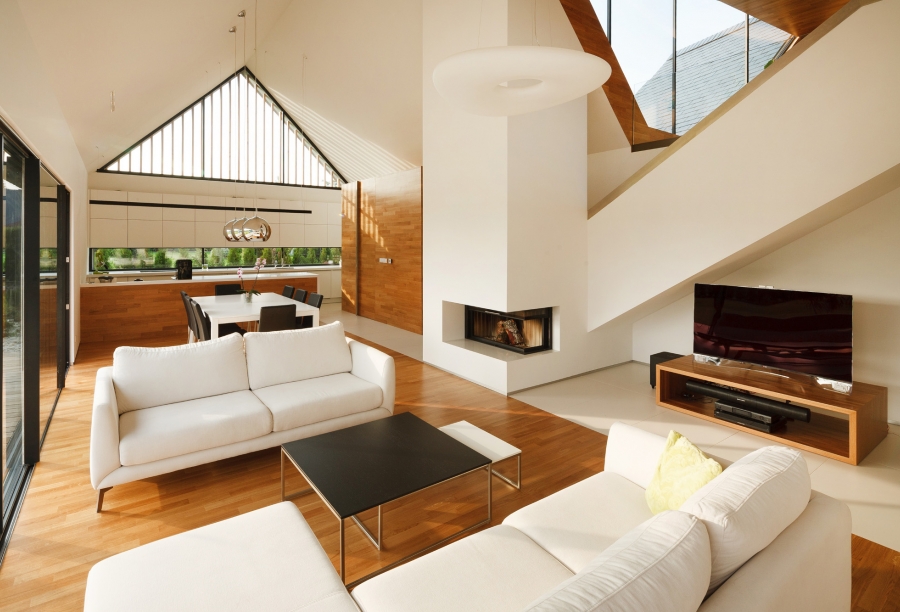
Image resolution: width=900 pixels, height=612 pixels. In order to click on dining room table in this screenshot , I will do `click(241, 311)`.